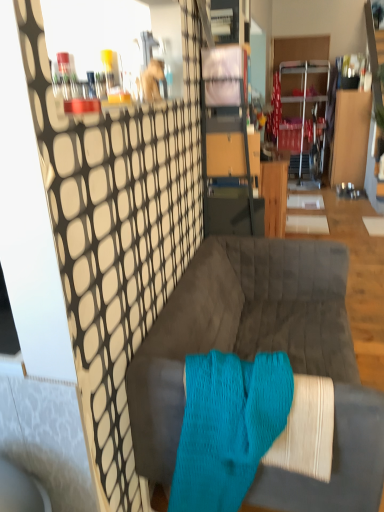
Question: Would you say wooden table at center is a long distance from aqua knitted sock at center?

Choices:
 (A) no
 (B) yes

Answer: (B)

Question: Does wooden table at center have a lesser width compared to aqua knitted sock at center?

Choices:
 (A) yes
 (B) no

Answer: (B)

Question: From a real-world perspective, is wooden table at center under aqua knitted sock at center?

Choices:
 (A) no
 (B) yes

Answer: (B)

Question: From the image's perspective, is wooden table at center over aqua knitted sock at center?

Choices:
 (A) yes
 (B) no

Answer: (A)

Question: From a real-world perspective, is wooden table at center over aqua knitted sock at center?

Choices:
 (A) no
 (B) yes

Answer: (A)

Question: Is the surface of wooden table at center in direct contact with aqua knitted sock at center?

Choices:
 (A) no
 (B) yes

Answer: (A)

Question: Is velvet gray couch at center positioned with its back to wooden table at center?

Choices:
 (A) yes
 (B) no

Answer: (B)

Question: Is the depth of velvet gray couch at center greater than that of wooden table at center?

Choices:
 (A) yes
 (B) no

Answer: (B)

Question: From a real-world perspective, is velvet gray couch at center physically above wooden table at center?

Choices:
 (A) yes
 (B) no

Answer: (B)

Question: Is velvet gray couch at center bigger than wooden table at center?

Choices:
 (A) no
 (B) yes

Answer: (B)

Question: Can you see velvet gray couch at center touching wooden table at center?

Choices:
 (A) yes
 (B) no

Answer: (B)

Question: Is velvet gray couch at center surrounding wooden table at center?

Choices:
 (A) no
 (B) yes

Answer: (A)

Question: Are velvet gray couch at center and aqua knitted sock at center far apart?

Choices:
 (A) no
 (B) yes

Answer: (A)